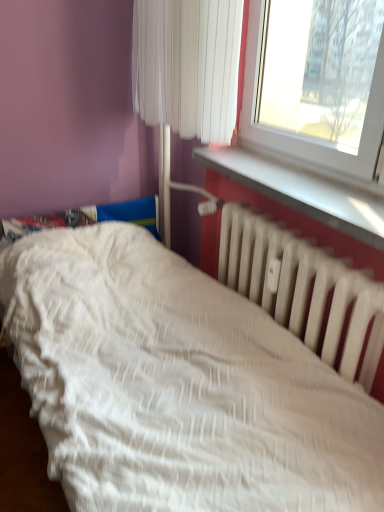
Question: Considering the relative sizes of white plastic window sill at upper right and white matte radiator at lower right in the image provided, is white plastic window sill at upper right taller than white matte radiator at lower right?

Choices:
 (A) no
 (B) yes

Answer: (A)

Question: Is white plastic window sill at upper right facing towards white matte radiator at lower right?

Choices:
 (A) no
 (B) yes

Answer: (A)

Question: Does white plastic window sill at upper right come behind white matte radiator at lower right?

Choices:
 (A) no
 (B) yes

Answer: (A)

Question: From a real-world perspective, is white plastic window sill at upper right on white matte radiator at lower right?

Choices:
 (A) no
 (B) yes

Answer: (B)

Question: Can we say white plastic window sill at upper right lies outside white matte radiator at lower right?

Choices:
 (A) yes
 (B) no

Answer: (A)

Question: Looking at the image, does white textured bed at lower left seem bigger or smaller compared to white plastic window sill at upper right?

Choices:
 (A) small
 (B) big

Answer: (B)

Question: Considering the relative positions of white textured bed at lower left and white plastic window sill at upper right in the image provided, is white textured bed at lower left to the left or to the right of white plastic window sill at upper right?

Choices:
 (A) right
 (B) left

Answer: (B)

Question: Looking at their shapes, would you say white textured bed at lower left is wider or thinner than white plastic window sill at upper right?

Choices:
 (A) thin
 (B) wide

Answer: (B)

Question: Choose the correct answer: Is white textured bed at lower left inside white plastic window sill at upper right or outside it?

Choices:
 (A) outside
 (B) inside

Answer: (A)

Question: From the image's perspective, is white textured bed at lower left above or below white matte radiator at lower right?

Choices:
 (A) above
 (B) below

Answer: (B)

Question: Is point (145, 325) positioned closer to the camera than point (251, 285)?

Choices:
 (A) farther
 (B) closer

Answer: (B)

Question: Visually, is white textured bed at lower left positioned to the left or to the right of white matte radiator at lower right?

Choices:
 (A) left
 (B) right

Answer: (A)

Question: From a real-world perspective, is white textured bed at lower left physically located above or below white matte radiator at lower right?

Choices:
 (A) below
 (B) above

Answer: (A)

Question: From the image's perspective, is white fabric curtain at upper center above or below white matte radiator at lower right?

Choices:
 (A) below
 (B) above

Answer: (B)

Question: Which is correct: white fabric curtain at upper center is inside white matte radiator at lower right, or outside of it?

Choices:
 (A) inside
 (B) outside

Answer: (B)